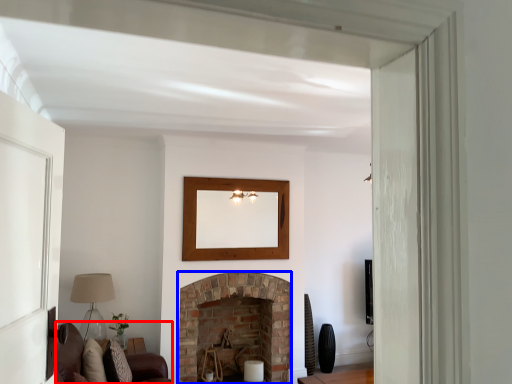
Question: Which object appears closest to the camera in this image, couch (highlighted by a red box) or fireplace (highlighted by a blue box)?

Choices:
 (A) couch
 (B) fireplace

Answer: (A)